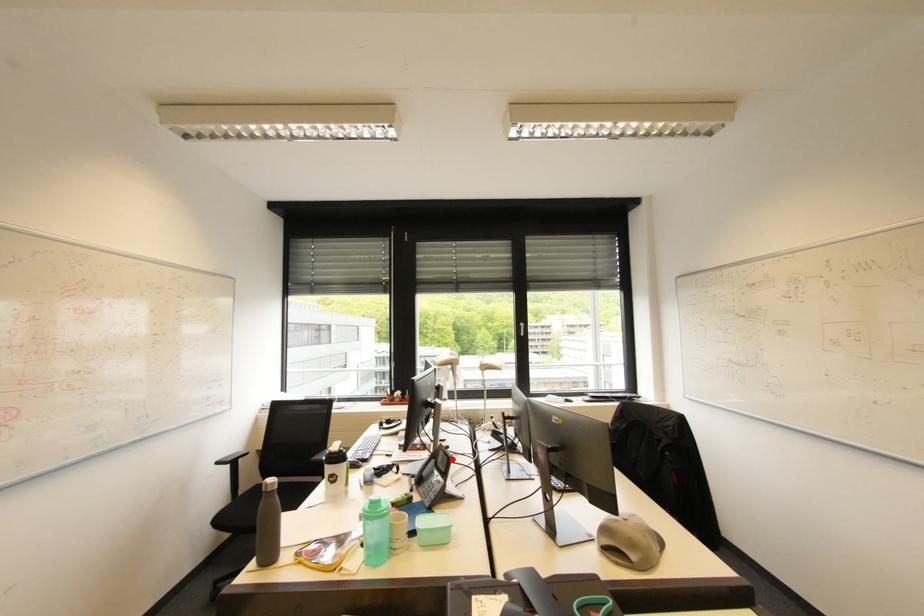
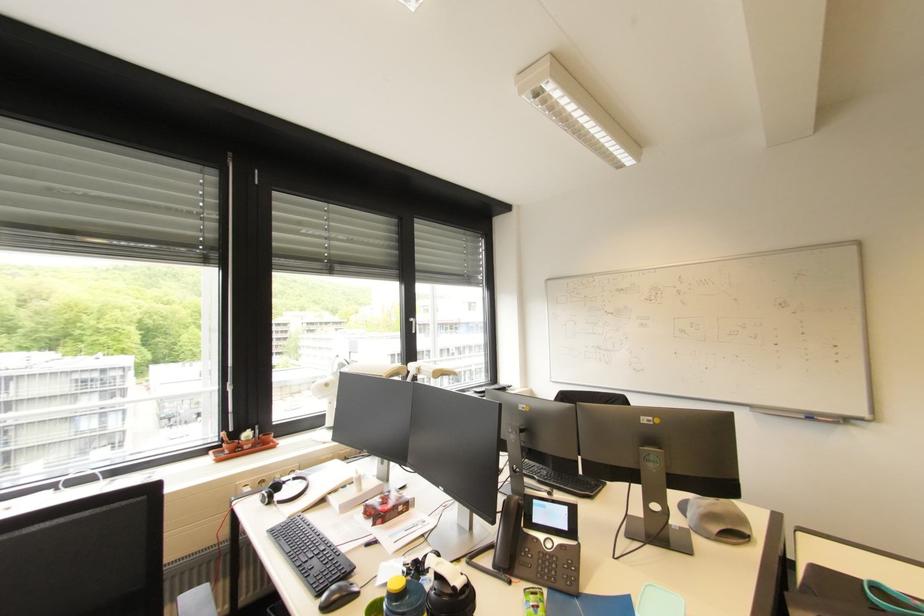
Find the pixel in the second image that matches the highlighted location in the first image.

(572, 509)